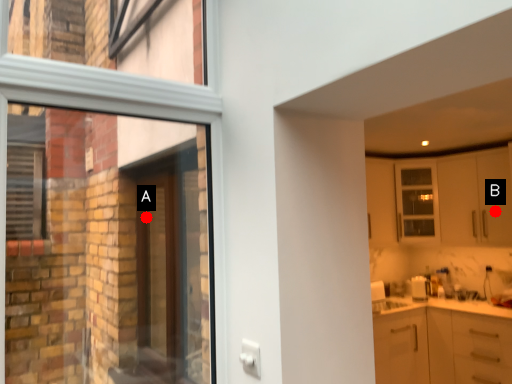
Question: Two points are circled on the image, labeled by A and B beside each circle. Which point is closer to the camera?

Choices:
 (A) A is closer
 (B) B is closer

Answer: (A)